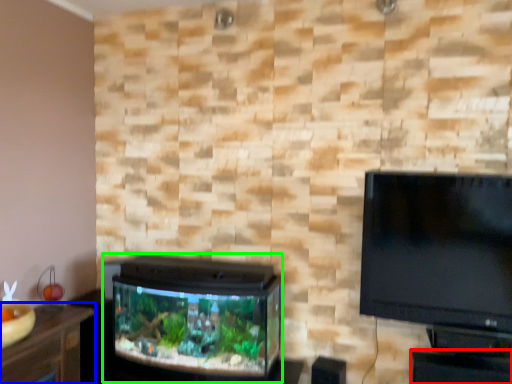
Question: Which object is positioned closest to table (highlighted by a red box)? Select from furniture (highlighted by a blue box) and tv cabinet (highlighted by a green box).

Choices:
 (A) furniture
 (B) tv cabinet

Answer: (B)